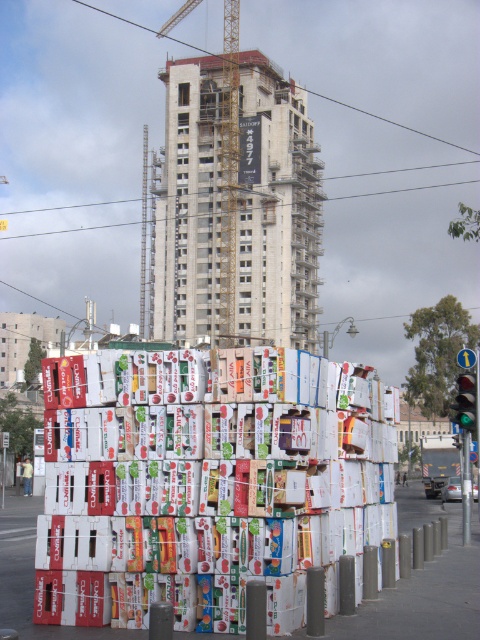
How much distance is there between green glass traffic light at center right and green traffic light at right?

1.88 meters

Who is more distant from viewer, [451,404] or [468,460]?

The point [451,404] is more distant.

Does point (462, 413) come farther from viewer compared to point (463, 483)?

No.

Locate an element on the screen. The height and width of the screenshot is (640, 480). green glass traffic light at center right is located at coordinates (466, 401).

Does yellow metal crane at upper center appear over green traffic light at right?

Yes, yellow metal crane at upper center is above green traffic light at right.

Image resolution: width=480 pixels, height=640 pixels. What do you see at coordinates (229, 156) in the screenshot?
I see `yellow metal crane at upper center` at bounding box center [229, 156].

What do you see at coordinates (229, 156) in the screenshot? The height and width of the screenshot is (640, 480). I see `yellow metal crane at upper center` at bounding box center [229, 156].

Where is `yellow metal crane at upper center`? This screenshot has width=480, height=640. yellow metal crane at upper center is located at coordinates (229, 156).

Is the position of yellow metal crane at upper center more distant than that of green glass traffic light at center right?

Yes, it is behind green glass traffic light at center right.

Which is in front, point (226, 204) or point (459, 381)?

Point (459, 381) is in front.

At what (x,y) coordinates should I click in order to perform the action: click on yellow metal crane at upper center. Please return your answer as a coordinate pair (x, y). Looking at the image, I should click on (229, 156).